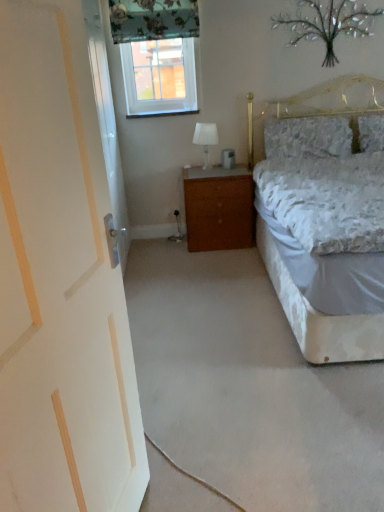
Image resolution: width=384 pixels, height=512 pixels. Describe the element at coordinates (328, 24) in the screenshot. I see `metallic silver tree at upper center` at that location.

Locate an element on the screen. floral fabric curtain at upper center is located at coordinates (153, 19).

Measure the distance between point (x=222, y=246) and camera.

They are 3.60 meters apart.

At what (x,y) coordinates should I click in order to perform the action: click on clear glass window at upper center. Please return your answer as a coordinate pair (x, y). The image size is (384, 512). Looking at the image, I should click on (159, 69).

In order to face white glass table lamp at center, should I rotate leftwards or rightwards?

To face it directly, rotate right by 1.709 degrees.

This screenshot has height=512, width=384. Describe the element at coordinates (60, 283) in the screenshot. I see `white painted wood door at left` at that location.

Measure the distance between white painted wood door at left and camera.

white painted wood door at left and camera are 28.23 inches apart.

Where is `metallic silver tree at upper center`? metallic silver tree at upper center is located at coordinates (328, 24).

From a real-world perspective, is fluffy white pillow at upper right, positioned as the 1th pillow in left-to-right order, below fluffy white pillow at upper right, which appears as the second pillow when viewed from the left?

Incorrect, from a real-world perspective, fluffy white pillow at upper right, positioned as the 1th pillow in left-to-right order, is higher than fluffy white pillow at upper right, which appears as the second pillow when viewed from the left.

Does fluffy white pillow at upper right, positioned as the 1th pillow in left-to-right order, come behind fluffy white pillow at upper right, which appears as the second pillow when viewed from the left?

That is False.

Considering the relative sizes of fluffy white pillow at upper right, acting as the 2th pillow starting from the right, and fluffy white pillow at upper right, the first pillow positioned from the right, in the image provided, is fluffy white pillow at upper right, acting as the 2th pillow starting from the right, taller than fluffy white pillow at upper right, the first pillow positioned from the right,?

Yes, fluffy white pillow at upper right, acting as the 2th pillow starting from the right, is taller than fluffy white pillow at upper right, the first pillow positioned from the right.

In terms of size, does fluffy white pillow at upper right, positioned as the 1th pillow in left-to-right order, appear bigger or smaller than fluffy white pillow at upper right, the first pillow positioned from the right?

Clearly, fluffy white pillow at upper right, positioned as the 1th pillow in left-to-right order, is larger in size than fluffy white pillow at upper right, the first pillow positioned from the right.

Which is behind, point (196, 138) or point (15, 40)?

The point (196, 138) is behind.

Choose the correct answer: Is white glass table lamp at center inside white painted wood door at left or outside it?

white glass table lamp at center is not enclosed by white painted wood door at left.

Which object is positioned more to the left, clear glass window at upper center or fluffy white pillow at upper right, positioned as the 1th pillow in left-to-right order?

clear glass window at upper center is more to the left.

Is point (159, 86) positioned behind point (342, 128)?

Yes, point (159, 86) is behind point (342, 128).

How far apart are clear glass window at upper center and fluffy white pillow at upper right, acting as the 2th pillow starting from the right?

3.50 feet.

Between clear glass window at upper center and fluffy white pillow at upper right, positioned as the 1th pillow in left-to-right order, which one has larger size?

fluffy white pillow at upper right, positioned as the 1th pillow in left-to-right order, is bigger.

From the image's perspective, would you say metallic silver tree at upper center is positioned over floral fabric curtain at upper center?

Incorrect, from the image's perspective, metallic silver tree at upper center is lower than floral fabric curtain at upper center.

How many degrees apart are the facing directions of metallic silver tree at upper center and floral fabric curtain at upper center?

They differ by 0.15 degrees in their facing directions.

Consider the image. Between metallic silver tree at upper center and floral fabric curtain at upper center, which one appears on the left side from the viewer's perspective?

floral fabric curtain at upper center.

Locate an element on the screen. Image resolution: width=384 pixels, height=512 pixels. curtain above the metallic silver tree at upper center (from the image's perspective) is located at coordinates pos(153,19).

Which object is thinner, fluffy white pillow at upper right, the first pillow positioned from the right, or wooden nightstand at center?

fluffy white pillow at upper right, the first pillow positioned from the right, is thinner.

Would you say fluffy white pillow at upper right, the first pillow positioned from the right, is to the left or to the right of wooden nightstand at center in the picture?

fluffy white pillow at upper right, the first pillow positioned from the right, is to the right of wooden nightstand at center.

Consider the image. From a real-world perspective, is fluffy white pillow at upper right, the first pillow positioned from the right, located higher than wooden nightstand at center?

Yes, from a real-world perspective, fluffy white pillow at upper right, the first pillow positioned from the right, is above wooden nightstand at center.

Between point (375, 126) and point (244, 200), which one is positioned behind?

The point (375, 126) is more distant.

From the picture: From a real-world perspective, does fluffy white pillow at upper right, the first pillow positioned from the right, sit lower than metallic silver tree at upper center?

Indeed, from a real-world perspective, fluffy white pillow at upper right, the first pillow positioned from the right, is positioned beneath metallic silver tree at upper center.

You are a GUI agent. You are given a task and a screenshot of the screen. Output one action in this format:
    pyautogui.click(x=<x>, y=<y>)
    Task: Click on the pillow to the right of metallic silver tree at upper center
    
    Given the screenshot: What is the action you would take?
    pyautogui.click(x=371, y=132)

Is fluffy white pillow at upper right, the first pillow positioned from the right, turned away from metallic silver tree at upper center?

fluffy white pillow at upper right, the first pillow positioned from the right, does not have its back to metallic silver tree at upper center.

Which object is positioned more to the left, fluffy white pillow at upper right, the first pillow positioned from the right, or metallic silver tree at upper center?

metallic silver tree at upper center is more to the left.

Is white painted wood door at left in contact with clear glass window at upper center?

No, white painted wood door at left is not with clear glass window at upper center.

Could you tell me if white painted wood door at left is facing clear glass window at upper center?

No, white painted wood door at left is not turned towards clear glass window at upper center.

Is white painted wood door at left thinner than clear glass window at upper center?

No.

Considering the relative positions of white painted wood door at left and clear glass window at upper center in the image provided, is white painted wood door at left to the left or to the right of clear glass window at upper center?

Based on their positions, white painted wood door at left is located to the left of clear glass window at upper center.

The width and height of the screenshot is (384, 512). Find the location of `pillow below the fluffy white pillow at upper right, which appears as the second pillow when viewed from the left (from the image's perspective)`. pillow below the fluffy white pillow at upper right, which appears as the second pillow when viewed from the left (from the image's perspective) is located at coordinates (307, 137).

In order to click on table lamp behind the white painted wood door at left in this screenshot , I will do `click(205, 140)`.

Considering their positions, is white painted wood door at left positioned closer to white glossy door at left than floral fabric curtain at upper center?

floral fabric curtain at upper center is closer to white glossy door at left.

From the image, which object appears to be farther from clear glass window at upper center, floral fabric curtain at upper center or fluffy white pillow at upper right, positioned as the 1th pillow in left-to-right order?

fluffy white pillow at upper right, positioned as the 1th pillow in left-to-right order, is further to clear glass window at upper center.

From the image, which object appears to be nearer to metallic silver tree at upper center, wooden nightstand at center or white painted wood door at left?

wooden nightstand at center.

From the image, which object appears to be nearer to white glass table lamp at center, white painted wood door at left or fluffy white pillow at upper right, the first pillow positioned from the right?

Based on the image, fluffy white pillow at upper right, the first pillow positioned from the right, appears to be nearer to white glass table lamp at center.

Which object lies nearer to the anchor point white painted wood door at left, metallic silver tree at upper center or fluffy white pillow at upper right, acting as the 2th pillow starting from the right?

Among the two, fluffy white pillow at upper right, acting as the 2th pillow starting from the right, is located nearer to white painted wood door at left.

When comparing their distances from white glossy door at left, does white glass table lamp at center or clear glass window at upper center seem further?

The object further to white glossy door at left is white glass table lamp at center.

When comparing their distances from clear glass window at upper center, does wooden nightstand at center or white glossy door at left seem further?

wooden nightstand at center.

When comparing their distances from white glass table lamp at center, does floral fabric curtain at upper center or fluffy white pillow at upper right, the first pillow positioned from the right, seem further?

fluffy white pillow at upper right, the first pillow positioned from the right, lies further to white glass table lamp at center than the other object.

Locate an element on the screen. The image size is (384, 512). nightstand between white glossy door at left and clear glass window at upper center along the z-axis is located at coordinates (219, 208).

Where is `window screen between floral fabric curtain at upper center and fluffy white pillow at upper right, positioned as the 1th pillow in left-to-right order, in the horizontal direction`? window screen between floral fabric curtain at upper center and fluffy white pillow at upper right, positioned as the 1th pillow in left-to-right order, in the horizontal direction is located at coordinates (159, 69).

The height and width of the screenshot is (512, 384). Identify the location of curtain positioned between white painted wood door at left and wooden nightstand at center from near to far. (153, 19).

Where is `table lamp between clear glass window at upper center and wooden nightstand at center in the vertical direction`? table lamp between clear glass window at upper center and wooden nightstand at center in the vertical direction is located at coordinates (205, 140).